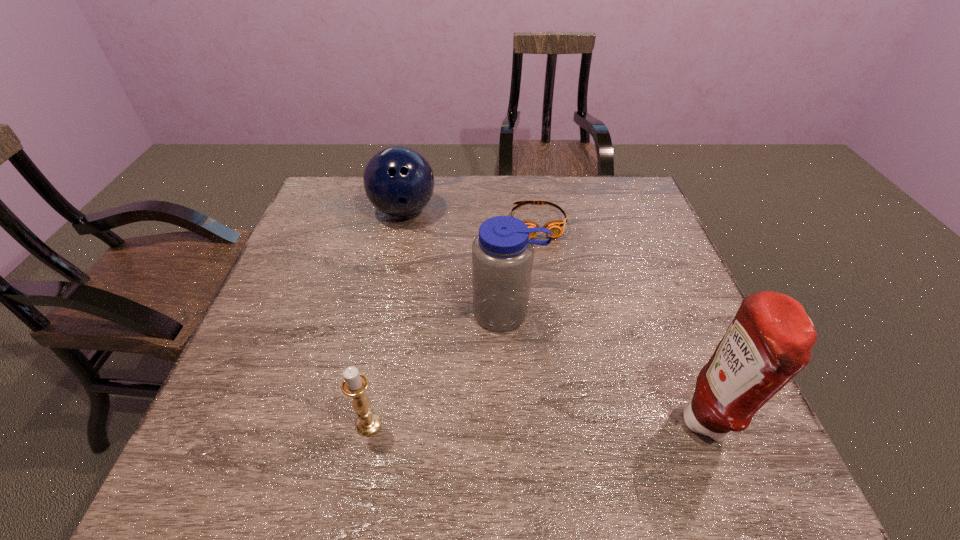
This screenshot has width=960, height=540. I want to click on vacant area that lies between the shortest object and the tallest object, so click(x=623, y=322).

Find the location of `unoccupied position between the bowling ball and the goggles`. unoccupied position between the bowling ball and the goggles is located at coordinates (470, 216).

You are a GUI agent. You are given a task and a screenshot of the screen. Output one action in this format:
    pyautogui.click(x=<x>, y=<y>)
    Task: Click on the free space that is in between the water bottle and the candle holder
    
    Given the screenshot: What is the action you would take?
    pyautogui.click(x=438, y=369)

Where is `vacant area that lies between the shortest object and the bowling ball`? Image resolution: width=960 pixels, height=540 pixels. vacant area that lies between the shortest object and the bowling ball is located at coordinates (470, 216).

Locate an element on the screen. This screenshot has height=540, width=960. unoccupied area between the goggles and the bowling ball is located at coordinates pyautogui.click(x=470, y=216).

I want to click on vacant area that lies between the candle holder and the bowling ball, so click(x=386, y=318).

Where is `free space that is in between the tallest object and the water bottle`? Image resolution: width=960 pixels, height=540 pixels. free space that is in between the tallest object and the water bottle is located at coordinates (608, 368).

Locate an element on the screen. free point between the bowling ball and the water bottle is located at coordinates (455, 262).

Where is `the third closest object relative to the condiment`? The width and height of the screenshot is (960, 540). the third closest object relative to the condiment is located at coordinates (354, 384).

Select which object appears as the second closest to the goggles. Please provide its 2D coordinates. Your answer should be formatted as a tuple, i.e. [(x, y)], where the tuple contains the x and y coordinates of a point satisfying the conditions above.

[(398, 180)]